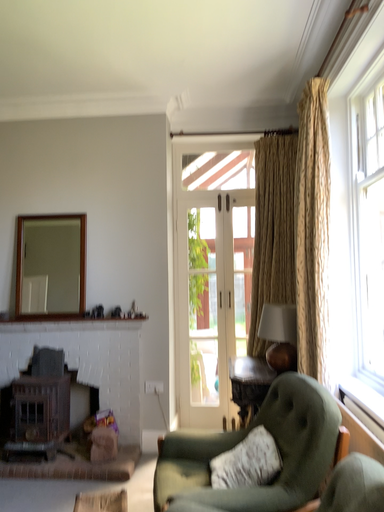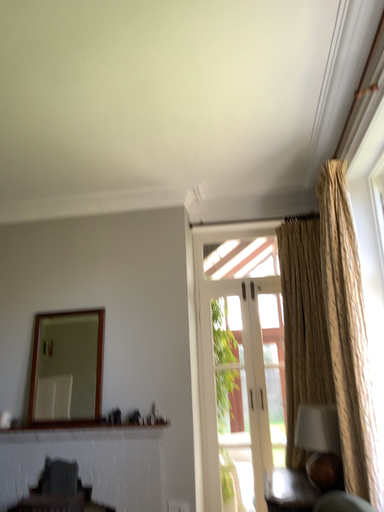
Question: How did the camera likely rotate when shooting the video?

Choices:
 (A) rotated upward
 (B) rotated downward

Answer: (A)